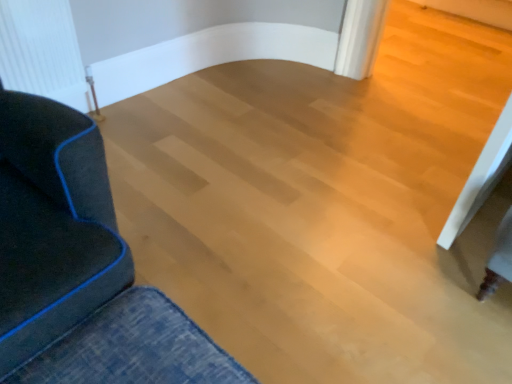
Find the location of a particular element. This screenshot has width=512, height=384. velvet dark blue sofa at left is located at coordinates (80, 267).

In order to face velvet dark blue sofa at left, should I rotate leftwards or rightwards?

To face it directly, rotate left by 33.817 degrees.

What do you see at coordinates (80, 267) in the screenshot?
I see `velvet dark blue sofa at left` at bounding box center [80, 267].

Locate an element on the screen. The width and height of the screenshot is (512, 384). velvet dark blue sofa at left is located at coordinates (80, 267).